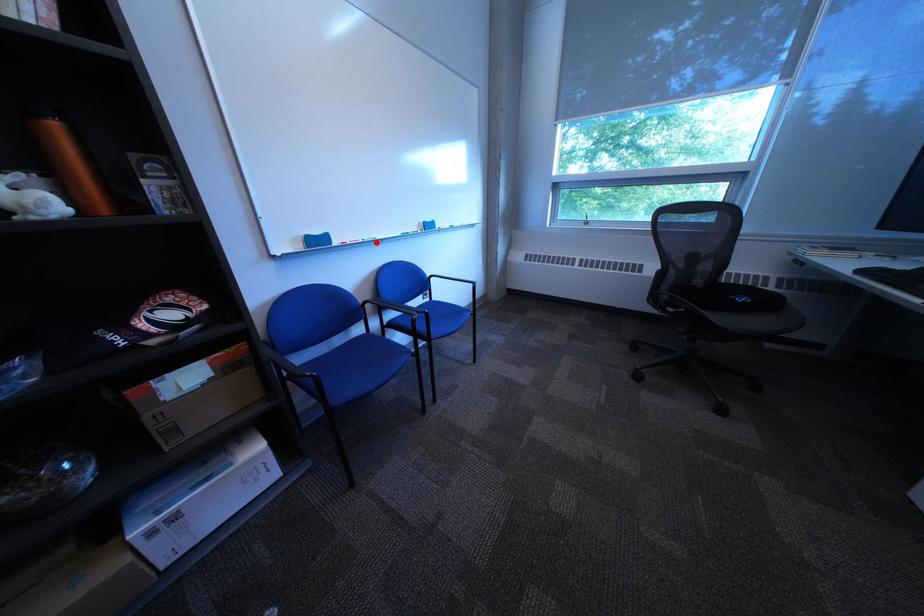
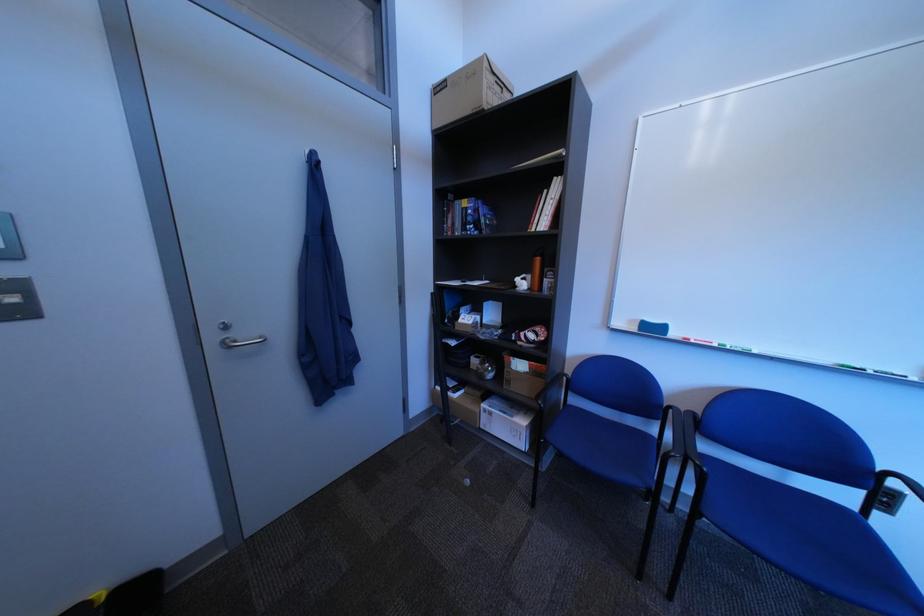
Question: I am providing you with two images of the same scene from different viewpoints. In image1, a red point is highlighted. Considering the same 3D point in image2, which of the following is correct?

Choices:
 (A) It is closer
 (B) It is farther

Answer: (B)